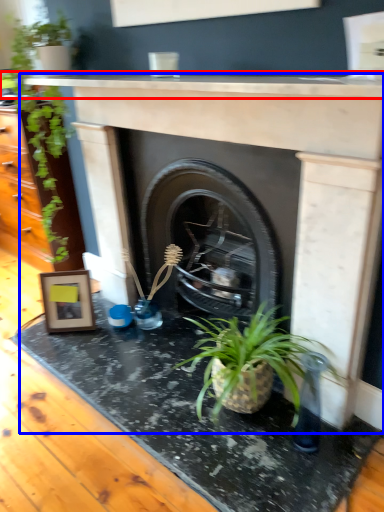
Question: Which of the following is the closest to the observer, counter top (highlighted by a red box) or fireplace (highlighted by a blue box)?

Choices:
 (A) counter top
 (B) fireplace

Answer: (A)